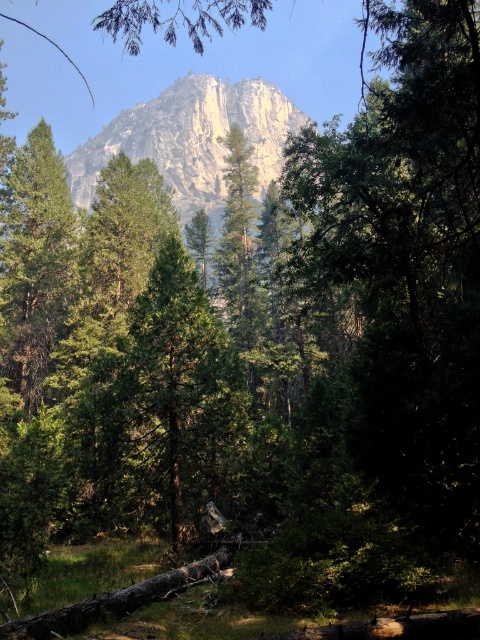
Which is more to the left, smooth rock mountain at upper center or green matte tree at left?

smooth rock mountain at upper center is more to the left.

Is smooth rock mountain at upper center smaller than green matte tree at left?

No, smooth rock mountain at upper center is not smaller than green matte tree at left.

What are the coordinates of `smooth rock mountain at upper center` in the screenshot? It's located at (192, 140).

Where is `smooth rock mountain at upper center`? This screenshot has height=640, width=480. smooth rock mountain at upper center is located at coordinates (192, 140).